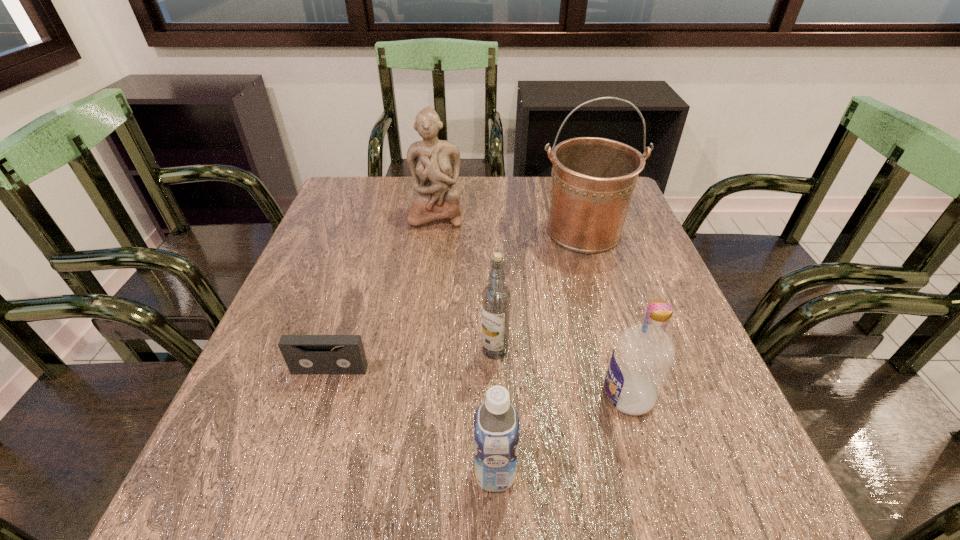
You are a GUI agent. You are given a task and a screenshot of the screen. Output one action in this format:
    pyautogui.click(x=<x>, y=<y>)
    Task: Click on the free space located on the front of the tallest object
    This screenshot has height=540, width=960.
    Given the screenshot: What is the action you would take?
    pyautogui.click(x=605, y=300)

Where is `vacant space located 0.200m on the front-facing side of the second tallest object`? vacant space located 0.200m on the front-facing side of the second tallest object is located at coordinates (427, 279).

You are a GUI agent. You are given a task and a screenshot of the screen. Output one action in this format:
    pyautogui.click(x=<x>, y=<y>)
    Task: Click on the free region located 0.050m on the label of the left vodka
    Image resolution: width=960 pixels, height=540 pixels.
    Given the screenshot: What is the action you would take?
    pyautogui.click(x=456, y=350)

Where is `free space located 0.380m on the label of the left vodka`? free space located 0.380m on the label of the left vodka is located at coordinates (287, 350).

You are a GUI agent. You are given a task and a screenshot of the screen. Output one action in this format:
    pyautogui.click(x=<x>, y=<y>)
    Task: Click on the vacant area situated 0.330m on the label of the left vodka
    The image size is (960, 540).
    Given the screenshot: What is the action you would take?
    pyautogui.click(x=312, y=350)

Locate an element on the screen. blank space located 0.130m on the label of the fifth farthest object is located at coordinates (529, 396).

Where is `free space located 0.250m on the label of the fifth farthest object`? free space located 0.250m on the label of the fifth farthest object is located at coordinates (462, 396).

Find the location of a particular element. The height and width of the screenshot is (540, 960). free space located 0.160m on the label of the fifth farthest object is located at coordinates (513, 396).

Where is `vacant space situated 0.320m on the label of the soya milk`? The height and width of the screenshot is (540, 960). vacant space situated 0.320m on the label of the soya milk is located at coordinates 267,473.

I want to click on free space located on the label of the soya milk, so click(x=221, y=473).